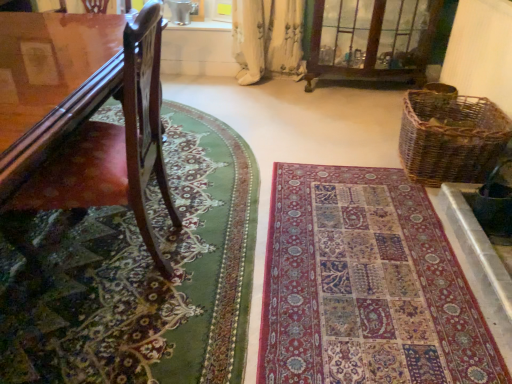
I want to click on free space between clear glass cabinet at upper center and woven brown picnic basket at right, so click(x=360, y=120).